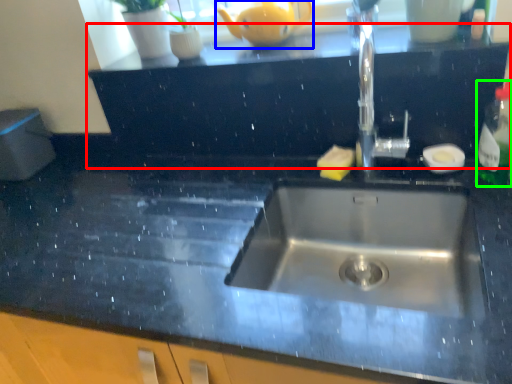
Question: Which object is positioned closest to dresser (highlighted by a red box)? Select from tea pot (highlighted by a blue box) and bottle (highlighted by a green box).

Choices:
 (A) tea pot
 (B) bottle

Answer: (A)